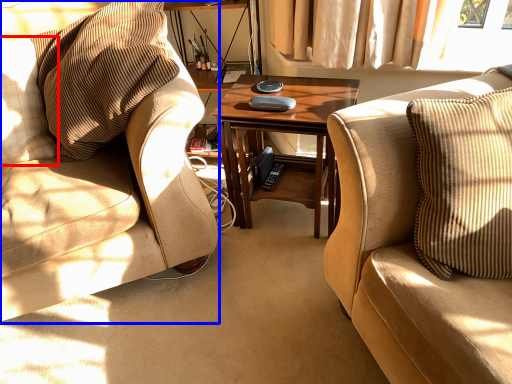
Question: Which of the following is the farthest to the observer, pillow (highlighted by a red box) or chair (highlighted by a blue box)?

Choices:
 (A) pillow
 (B) chair

Answer: (A)